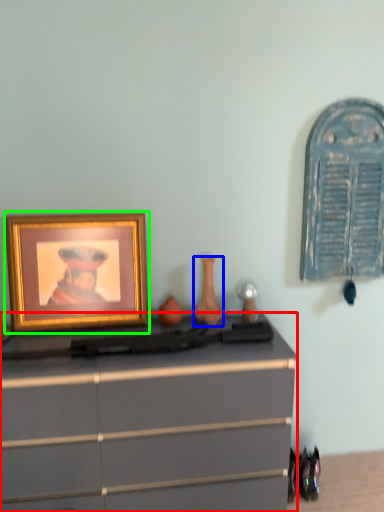
Question: Which object is positioned closest to chest of drawers (highlighted by a red box)? Select from vase (highlighted by a blue box) and picture frame (highlighted by a green box).

Choices:
 (A) vase
 (B) picture frame

Answer: (B)